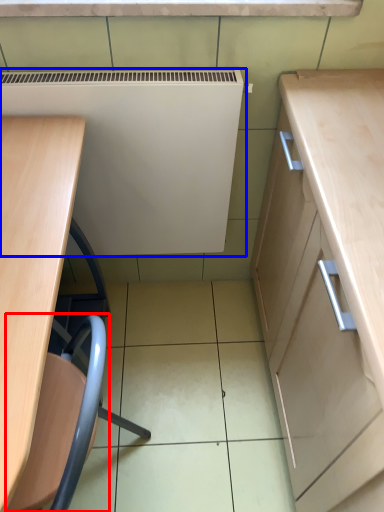
Question: Which object appears closest to the camera in this image, swivel chair (highlighted by a red box) or appliance (highlighted by a blue box)?

Choices:
 (A) swivel chair
 (B) appliance

Answer: (A)